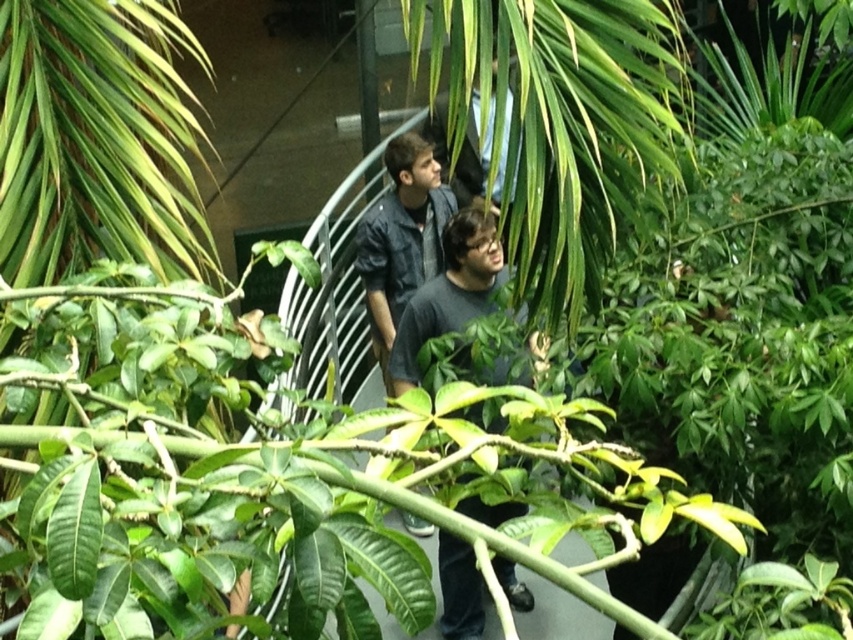
Question: Among these points, which one is farthest from the camera?

Choices:
 (A) (404, 157)
 (B) (503, 564)

Answer: (A)

Question: Among these points, which one is nearest to the camera?

Choices:
 (A) (387, 262)
 (B) (454, 576)

Answer: (B)

Question: Among these points, which one is nearest to the camera?

Choices:
 (A) (467, 499)
 (B) (387, 337)

Answer: (A)

Question: Is the position of dark gray shirt at center more distant than that of denim jacket at center?

Choices:
 (A) no
 (B) yes

Answer: (A)

Question: Is dark gray shirt at center further to camera compared to denim jacket at center?

Choices:
 (A) no
 (B) yes

Answer: (A)

Question: Does dark gray shirt at center come in front of denim jacket at center?

Choices:
 (A) no
 (B) yes

Answer: (B)